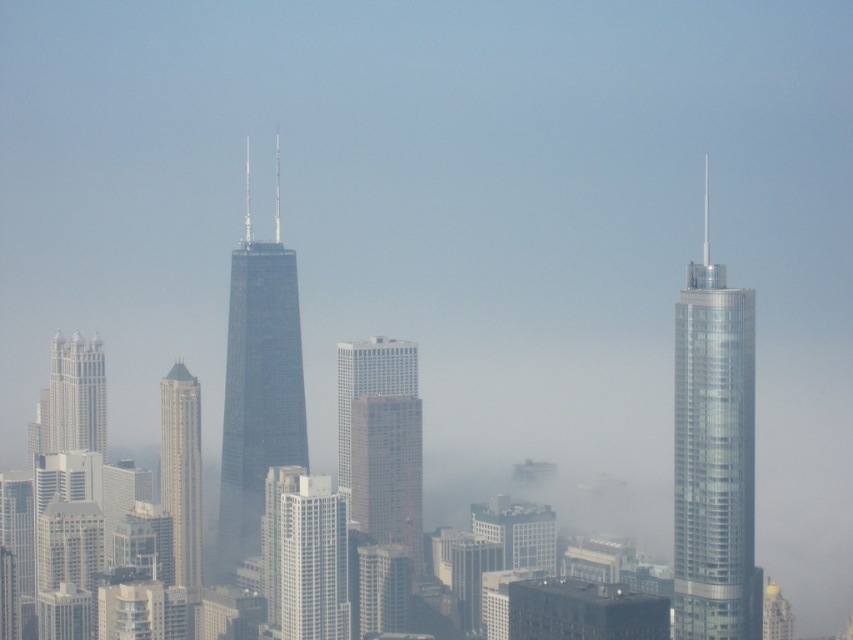
Between white textured building at center and white glass building at center, which one appears on the left side from the viewer's perspective?

From the viewer's perspective, white glass building at center appears more on the left side.

Who is shorter, white textured building at center or white glass building at center?

Standing shorter between the two is white glass building at center.

Describe the element at coordinates (381, 440) in the screenshot. I see `white textured building at center` at that location.

Where is `white textured building at center`? This screenshot has width=853, height=640. white textured building at center is located at coordinates (381, 440).

Which is behind, point (189, 525) or point (67, 380)?

Positioned behind is point (67, 380).

What do you see at coordinates (183, 474) in the screenshot? The height and width of the screenshot is (640, 853). I see `matte glass skyscraper at left` at bounding box center [183, 474].

Describe the element at coordinates (183, 474) in the screenshot. I see `matte glass skyscraper at left` at that location.

Where is `matte glass skyscraper at left`? matte glass skyscraper at left is located at coordinates (183, 474).

Does point (296, 552) come behind point (50, 442)?

No, it is not.

Who is more distant from viewer, (x=297, y=627) or (x=73, y=449)?

Point (x=73, y=449)

Does point (316, 480) come behind point (97, 342)?

No, it is in front of (97, 342).

At what (x,y) coordinates should I click in order to perform the action: click on white glass building at center. Please return your answer as a coordinate pair (x, y). The width and height of the screenshot is (853, 640). Looking at the image, I should click on (312, 561).